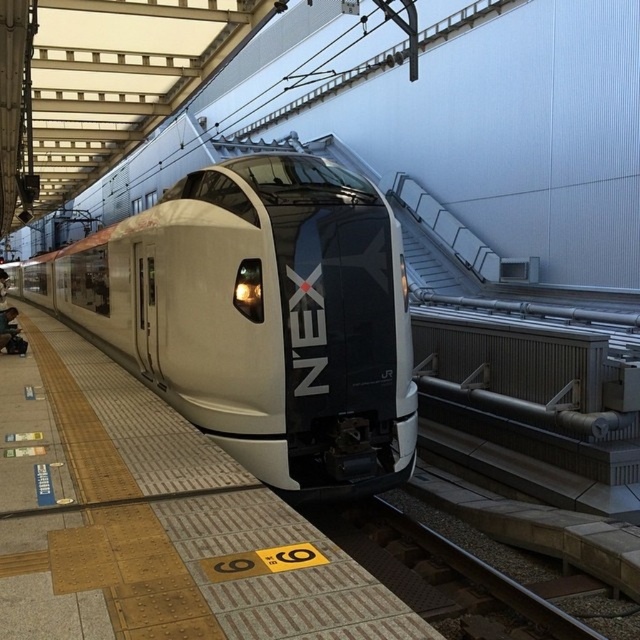
You are standing at the center of the platform. The platform has tactile paving at the edge. Where is the sleek metallic train at center located relative to your position?

The sleek metallic train at center is located at point coordinates of (x=259, y=317) relative to the platform, so it is positioned near the center of the platform.

Based on the photo, you are standing on the platform and want to board the NEX train. You see two points marked on the platform at coordinates point (x=276, y=164) and point (x=326, y=595). Which point is closer to the front of the train?

Point (x=326, y=595) is closer to the front of the train because point (x=276, y=164) is behind it.

You are a maintenance worker needing to access the smooth metal train track at center. The smooth beige platform at center is in your way. How can you reach the track?

The smooth beige platform at center is much taller than the smooth metal train track at center, so you can step down from the platform to reach the track.